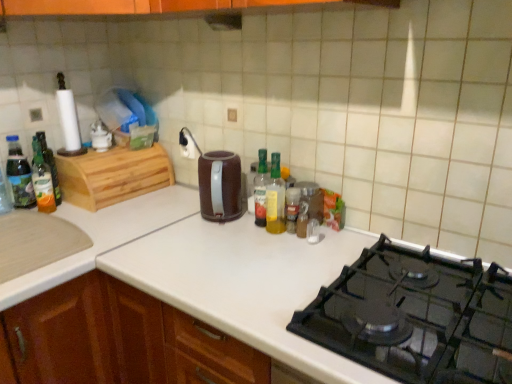
Question: Is translucent plastic bottle at left, which is the fifth bottle in right-to-left order, wider or thinner than translucent plastic bottle at center, positioned as the third bottle in right-to-left order?

Choices:
 (A) thin
 (B) wide

Answer: (B)

Question: From a real-world perspective, is translucent plastic bottle at left, which is the fifth bottle in right-to-left order, above or below translucent plastic bottle at center, the third bottle when ordered from left to right?

Choices:
 (A) below
 (B) above

Answer: (B)

Question: Based on their relative distances, which object is farther from the translucent plastic bottle at center, positioned as the second bottle in right-to-left order?

Choices:
 (A) translucent plastic bottle at center, the fifth bottle from the left
 (B) translucent plastic bottle at left, which is the fifth bottle in right-to-left order
 (C) black plastic exhaust hood at upper center
 (D) translucent glass bottle at left, placed as the 2th bottle when sorted from left to right
 (E) black matte gas stove at lower right

Answer: (B)

Question: Estimate the real-world distances between objects in this image. Which object is farther from the black matte gas stove at lower right?

Choices:
 (A) translucent glass bottle at left, placed as the 2th bottle when sorted from left to right
 (B) translucent plastic bottle at left, which is the fifth bottle in right-to-left order
 (C) black plastic exhaust hood at upper center
 (D) translucent plastic bottle at center, positioned as the second bottle in right-to-left order
 (E) translucent plastic bottle at center, the third bottle when ordered from left to right

Answer: (B)